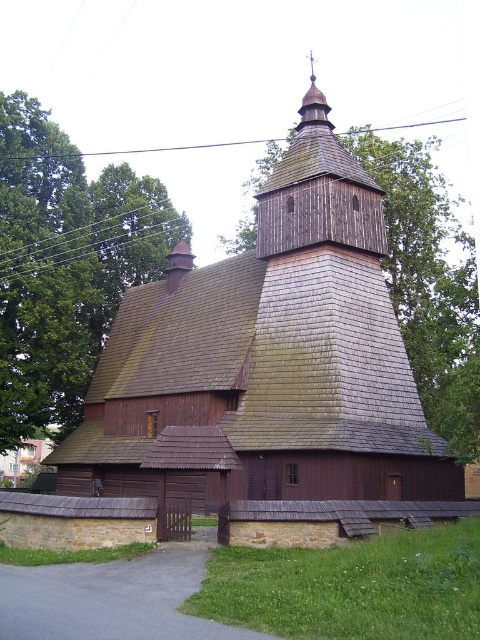
Question: Which object appears farthest from the camera in this image?

Choices:
 (A) green leafy tree at upper left
 (B) dark brown wooden church at center
 (C) brown wooden roof at upper center

Answer: (A)

Question: Based on their relative distances, which object is farther from the dark brown wooden church at center?

Choices:
 (A) green leafy tree at upper left
 (B) brown wooden roof at upper center
 (C) wooden spire at upper center

Answer: (C)

Question: Based on their relative distances, which object is nearer to the brown wooden roof at upper center?

Choices:
 (A) wooden spire at upper center
 (B) green leafy tree at upper left
 (C) dark brown wooden church at center

Answer: (C)

Question: Is dark brown wooden church at center wider than green leafy tree at upper left?

Choices:
 (A) yes
 (B) no

Answer: (A)

Question: Does dark brown wooden church at center appear on the right side of wooden spire at upper center?

Choices:
 (A) no
 (B) yes

Answer: (A)

Question: Is green leafy tree at upper left positioned at the back of brown wooden roof at upper center?

Choices:
 (A) no
 (B) yes

Answer: (B)